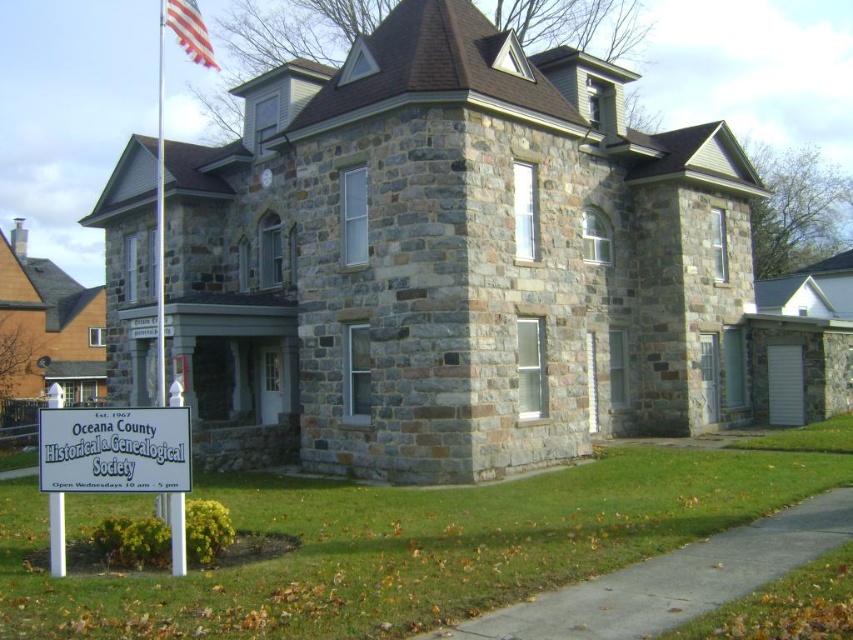
Who is positioned more to the right, metallic silver flag pole at upper left or american flag at upper left?

From the viewer's perspective, american flag at upper left appears more on the right side.

Is metallic silver flag pole at upper left above american flag at upper left?

No.

Which is behind, point (161, 35) or point (160, 13)?

The point (161, 35) is behind.

Where is `metallic silver flag pole at upper left`? The image size is (853, 640). metallic silver flag pole at upper left is located at coordinates (160, 220).

Based on the photo, is white plastic sign at lower left wider than american flag at upper left?

No.

The width and height of the screenshot is (853, 640). I want to click on white plastic sign at lower left, so click(x=114, y=449).

This screenshot has height=640, width=853. In order to click on white plastic sign at lower left in this screenshot , I will do `click(114, 449)`.

Does point (576, 561) come farther from viewer compared to point (184, 456)?

Yes, point (576, 561) is behind point (184, 456).

Which is in front, point (450, 570) or point (82, 477)?

Point (82, 477) is in front.

Identify the location of green grass at lower center. The image size is (853, 640). (415, 544).